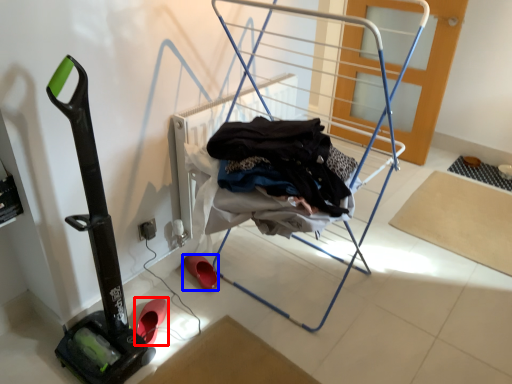
Question: Which of the following is the farthest to the observer, footwear (highlighted by a red box) or footwear (highlighted by a blue box)?

Choices:
 (A) footwear
 (B) footwear

Answer: (B)